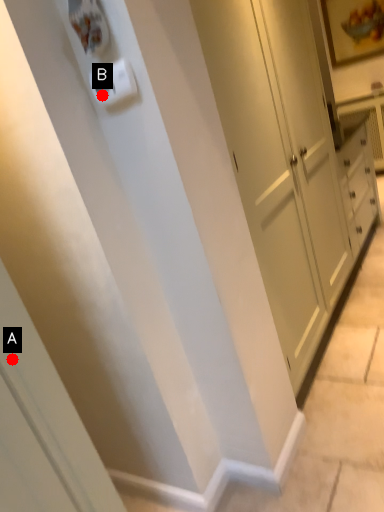
Question: Two points are circled on the image, labeled by A and B beside each circle. Which point is closer to the camera?

Choices:
 (A) A is closer
 (B) B is closer

Answer: (A)